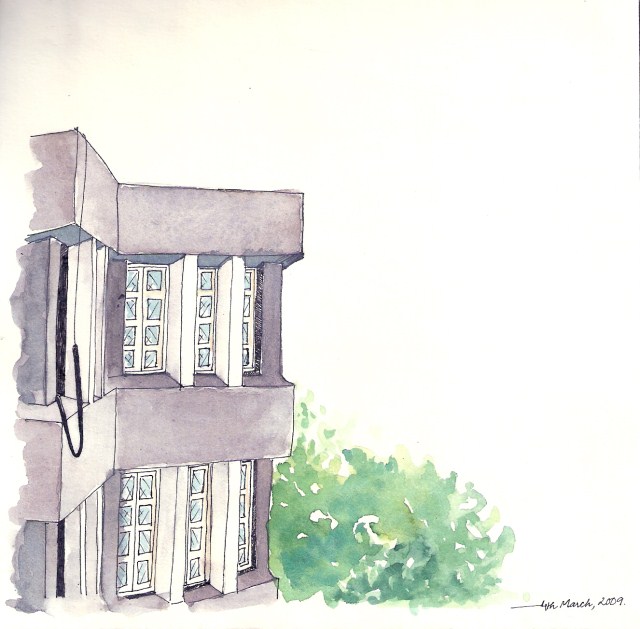
Identify the location of window ledge. (200, 592), (152, 380), (201, 377), (255, 377), (260, 572), (145, 601).